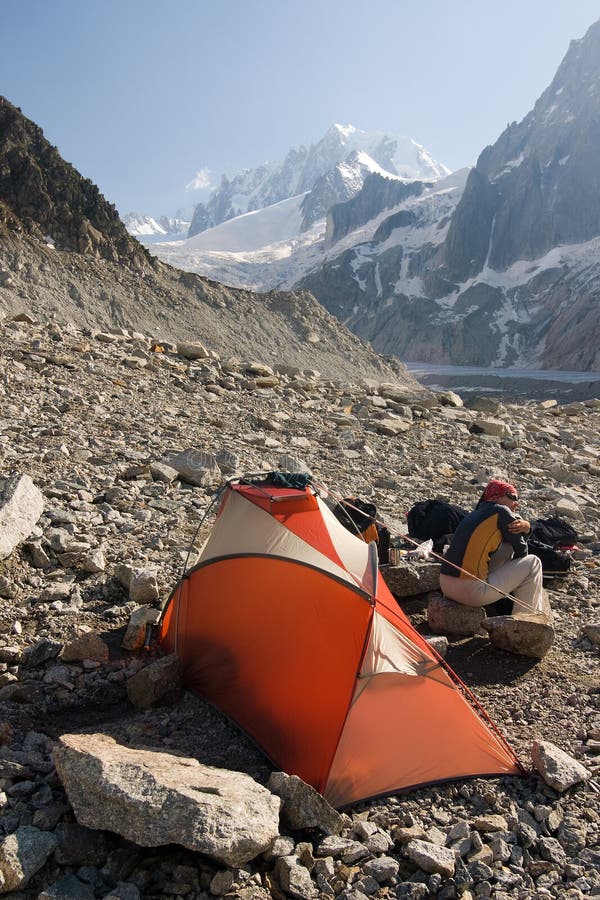
Identify the location of towel. This screenshot has width=600, height=900. (298, 478).